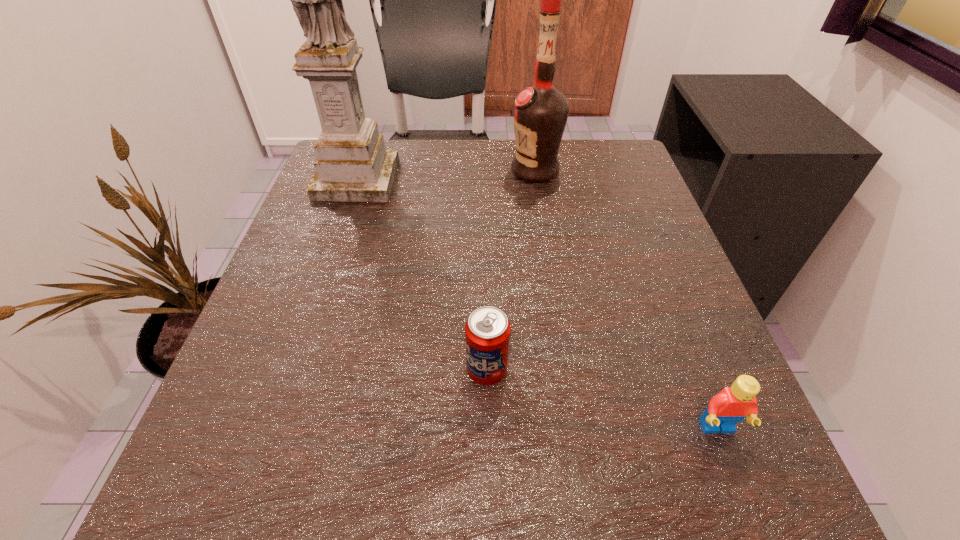
This screenshot has width=960, height=540. In the image, there is a desktop. Find the location of `free space at the left edge`. free space at the left edge is located at coordinates (318, 240).

Identify the location of free space at the right edge of the desktop. (608, 208).

The image size is (960, 540). Find the location of `blank space at the far right corner`. blank space at the far right corner is located at coordinates (606, 146).

At what (x,y) coordinates should I click in order to perform the action: click on free space between the leftmost object and the Lego. Please return your answer as a coordinate pair (x, y). Looking at the image, I should click on (537, 304).

The height and width of the screenshot is (540, 960). I want to click on vacant point located between the Lego and the sculpture, so click(537, 304).

You are a GUI agent. You are given a task and a screenshot of the screen. Output one action in this format:
    pyautogui.click(x=<x>, y=<y>)
    Task: Click on the unoccupied position between the leftmost object and the third object from left to right
    The image size is (960, 540).
    Given the screenshot: What is the action you would take?
    pyautogui.click(x=445, y=175)

The height and width of the screenshot is (540, 960). In order to click on empty space between the rightmost object and the third object from right to left in this screenshot , I will do `click(602, 399)`.

Find the location of a particular element. The height and width of the screenshot is (540, 960). vacant space in between the third farthest object and the tallest object is located at coordinates (422, 275).

I want to click on free space between the leftmost object and the Lego, so click(x=537, y=304).

The height and width of the screenshot is (540, 960). Identify the location of free area in between the sculpture and the third object from left to right. (445, 175).